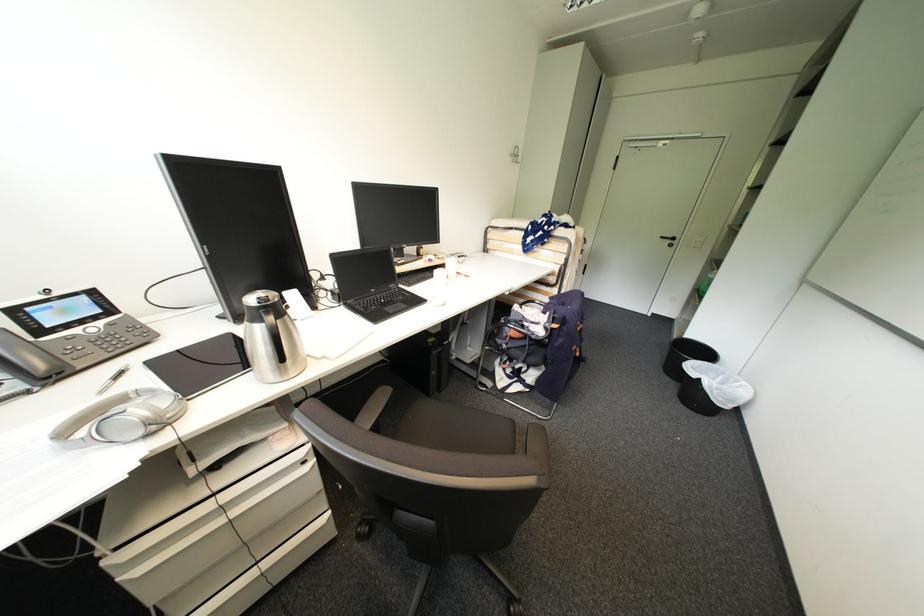
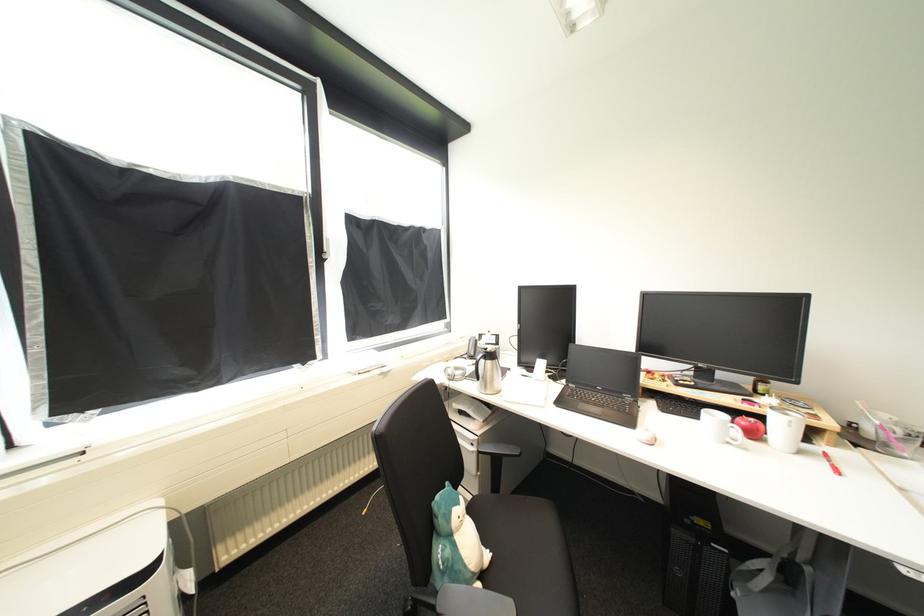
Find the pixel in the second image that matches (454,286) in the first image.

(736, 445)